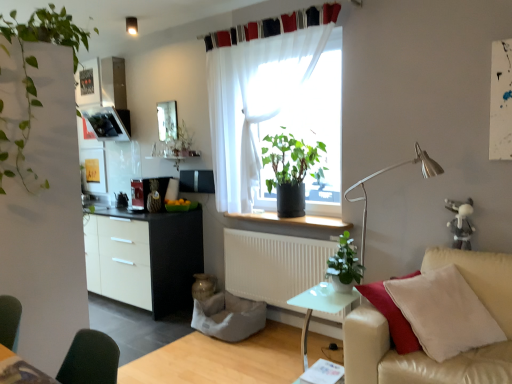
At what (x,y) coordinates should I click in order to perform the action: click on white sheer curtain at upper center, acting as the 1th curtain starting from the top. Please return your answer as a coordinate pair (x, y). Looking at the image, I should click on (273, 26).

Locate an element on the screen. transparent glass table at lower center is located at coordinates (320, 307).

Measure the distance between point (255, 213) and camera.

The distance of point (255, 213) from camera is 3.68 meters.

What is the approximate height of wooden at center?

2.14 inches.

I want to click on green matte plant at lower center, acting as the 3th houseplant starting from the left, so click(344, 266).

Image resolution: width=512 pixels, height=384 pixels. What do you see at coordinates (344, 266) in the screenshot?
I see `green matte plant at lower center, which is the second houseplant from back to front` at bounding box center [344, 266].

Locate an element on the screen. The image size is (512, 384). white sheer curtain at upper center, acting as the 1th curtain starting from the top is located at coordinates (273, 26).

From the image's perspective, would you say wooden at center is shown under white sheer curtain at upper center, which is the 2th curtain from bottom to top?

Yes, from the image's perspective, wooden at center is beneath white sheer curtain at upper center, which is the 2th curtain from bottom to top.

From a real-world perspective, is wooden at center below white sheer curtain at upper center, which is the 2th curtain from bottom to top?

Yes, from a real-world perspective, wooden at center is below white sheer curtain at upper center, which is the 2th curtain from bottom to top.

Can you tell me how much wooden at center and white sheer curtain at upper center, acting as the 1th curtain starting from the top, differ in facing direction?

The angular difference between wooden at center and white sheer curtain at upper center, acting as the 1th curtain starting from the top, is 0.236 degrees.

Are transparent glass window screen at upper center, the 2th window screen in the front-to-back sequence, and metallic silver toaster at left located far from each other?

That's not correct — transparent glass window screen at upper center, the 2th window screen in the front-to-back sequence, is a little close to metallic silver toaster at left.

From their relative heights in the image, would you say transparent glass window screen at upper center, which appears as the 1th window screen when viewed from the back, is taller or shorter than metallic silver toaster at left?

In the image, transparent glass window screen at upper center, which appears as the 1th window screen when viewed from the back, appears to be taller than metallic silver toaster at left.

Considering their positions, is transparent glass window screen at upper center, the 2th window screen in the front-to-back sequence, located in front of or behind metallic silver toaster at left?

Clearly, transparent glass window screen at upper center, the 2th window screen in the front-to-back sequence, is behind metallic silver toaster at left.

Would you say white matte radiator at lower center contains green matte plant at lower center, which appears as the second houseplant when viewed from the front?

No, white matte radiator at lower center does not contain green matte plant at lower center, which appears as the second houseplant when viewed from the front.

Is white matte radiator at lower center positioned with its back to green matte plant at lower center, marked as the first houseplant in a right-to-left arrangement?

That's not correct — white matte radiator at lower center is not looking away from green matte plant at lower center, marked as the first houseplant in a right-to-left arrangement.

Find the location of a particular element. This screenshot has height=384, width=512. radiator located underneath the green matte plant at lower center, acting as the 3th houseplant starting from the left (from a real-world perspective) is located at coordinates (273, 265).

What's the angular difference between white matte radiator at lower center and green matte plant at lower center, which is the second houseplant from back to front,'s facing directions?

white matte radiator at lower center and green matte plant at lower center, which is the second houseplant from back to front, are facing 0.801 degrees away from each other.

How distant is white sheer curtain at upper center, which is the 2th curtain from bottom to top, from green matte plant at center, the 2th houseplant in the left-to-right sequence?

3.30 feet.

Is point (267, 22) closer or farther from the camera than point (268, 189)?

Point (267, 22) is closer to the camera than point (268, 189).

From the image's perspective, is white sheer curtain at upper center, which is the 2th curtain from bottom to top, below green matte plant at center, which is the first houseplant from back to front?

No, from the image's perspective, white sheer curtain at upper center, which is the 2th curtain from bottom to top, is not beneath green matte plant at center, which is the first houseplant from back to front.

From the image's perspective, which curtain is the 2nd one above the green matte plant at center, positioned as the 2th houseplant in right-to-left order? Please provide its 2D coordinates.

[(273, 26)]

Would you say translucent fabric at center, the second window screen positioned from the back, is part of white sheer curtain at upper center, which appears as the second curtain when viewed from the top,'s contents?

That's incorrect, translucent fabric at center, the second window screen positioned from the back, is not inside white sheer curtain at upper center, which appears as the second curtain when viewed from the top.

What's the angular difference between white sheer curtain at upper center, acting as the first curtain starting from the bottom, and translucent fabric at center, which appears as the first window screen when viewed from the front,'s facing directions?

0.181 degrees.

Considering the positions of objects white sheer curtain at upper center, which appears as the second curtain when viewed from the top, and translucent fabric at center, placed as the 2th window screen when sorted from left to right, in the image provided, who is more to the left, white sheer curtain at upper center, which appears as the second curtain when viewed from the top, or translucent fabric at center, placed as the 2th window screen when sorted from left to right,?

Positioned to the left is white sheer curtain at upper center, which appears as the second curtain when viewed from the top.

From the image's perspective, which object appears higher, white matte radiator at lower center or translucent fabric at center, arranged as the 1th window screen when viewed from the right?

translucent fabric at center, arranged as the 1th window screen when viewed from the right, from the image's perspective.

Is white matte radiator at lower center beside translucent fabric at center, arranged as the 1th window screen when viewed from the right?

No.

Would you say translucent fabric at center, arranged as the 1th window screen when viewed from the right, is part of white matte radiator at lower center's contents?

No, translucent fabric at center, arranged as the 1th window screen when viewed from the right, is not surrounded by white matte radiator at lower center.

From a real-world perspective, between white matte radiator at lower center and translucent fabric at center, placed as the 2th window screen when sorted from left to right, who is vertically lower?

white matte radiator at lower center.

Which object is positioned more to the right, beige leather couch at right or white matte radiator at lower center?

beige leather couch at right.

From a real-world perspective, who is located higher, beige leather couch at right or white matte radiator at lower center?

white matte radiator at lower center.

Is beige leather couch at right placed right next to white matte radiator at lower center?

There is a gap between beige leather couch at right and white matte radiator at lower center.

From the image's perspective, which curtain is the 2nd one above the wooden at center? Please provide its 2D coordinates.

[(273, 26)]

Identify the location of appliance below the transparent glass window screen at upper center, the 2th window screen in the front-to-back sequence (from the image's perspective). (148, 192).

Based on their spatial positions, is green leafy plant at left, which is the first houseplant in front-to-back order, or metallic silver toaster at left further from white metal table lamp at right?

Among the two, green leafy plant at left, which is the first houseplant in front-to-back order, is located further to white metal table lamp at right.

Estimate the real-world distances between objects in this image. Which object is further from metallic silver toaster at left, white metal table lamp at right or white sheer curtain at upper center, acting as the first curtain starting from the bottom?

white metal table lamp at right is further to metallic silver toaster at left.

Estimate the real-world distances between objects in this image. Which object is closer to transparent glass table at lower center, white sheer curtain at upper center, acting as the 1th curtain starting from the top, or wooden at center?

wooden at center is closer to transparent glass table at lower center.

When comparing their distances from white matte radiator at lower center, does transparent glass table at lower center or green matte plant at lower center, acting as the 3th houseplant starting from the left, seem further?

green matte plant at lower center, acting as the 3th houseplant starting from the left, lies further to white matte radiator at lower center than the other object.

Looking at the image, which one is located further to green matte plant at lower center, which is the second houseplant from back to front, metallic silver toaster at left or translucent fabric at center, the second window screen positioned from the back?

metallic silver toaster at left is positioned further to the anchor green matte plant at lower center, which is the second houseplant from back to front.

Looking at the image, which one is located further to transparent glass window screen at upper center, which appears as the 1th window screen when viewed from the back, white matte radiator at lower center or transparent glass table at lower center?

The object further to transparent glass window screen at upper center, which appears as the 1th window screen when viewed from the back, is transparent glass table at lower center.

Based on their spatial positions, is transparent glass window screen at upper center, the first window screen in the left-to-right sequence, or wooden at center further from green matte plant at center, the 3th houseplant positioned from the front?

transparent glass window screen at upper center, the first window screen in the left-to-right sequence, lies further to green matte plant at center, the 3th houseplant positioned from the front, than the other object.

Based on their spatial positions, is metallic silver toaster at left or transparent glass window screen at upper center, the first window screen in the left-to-right sequence, closer to white matte radiator at lower center?

metallic silver toaster at left is positioned closer to the anchor white matte radiator at lower center.

At what (x,y) coordinates should I click in order to perform the action: click on window sill between green leafy plant at left, the third houseplant when ordered from right to left, and beige leather couch at right. Please return your answer as a coordinate pair (x, y). Looking at the image, I should click on (292, 220).

Find the location of `curtain between white sheer curtain at upper center, which is the 2th curtain from bottom to top, and transparent glass table at lower center vertically`. curtain between white sheer curtain at upper center, which is the 2th curtain from bottom to top, and transparent glass table at lower center vertically is located at coordinates click(276, 110).

Locate an element on the screen. The height and width of the screenshot is (384, 512). houseplant located between transparent glass table at lower center and wooden at center in the depth direction is located at coordinates (344, 266).

Where is `radiator located between beige leather couch at right and green matte plant at center, which is the first houseplant from back to front, in the depth direction`? The height and width of the screenshot is (384, 512). radiator located between beige leather couch at right and green matte plant at center, which is the first houseplant from back to front, in the depth direction is located at coordinates (273, 265).